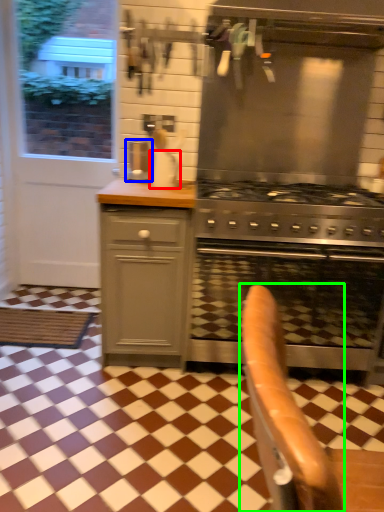
Question: Which object is the farthest from kitchen appliance (highlighted by a red box)? Choose among these: coffee machine (highlighted by a blue box) or armchair (highlighted by a green box).

Choices:
 (A) coffee machine
 (B) armchair

Answer: (B)